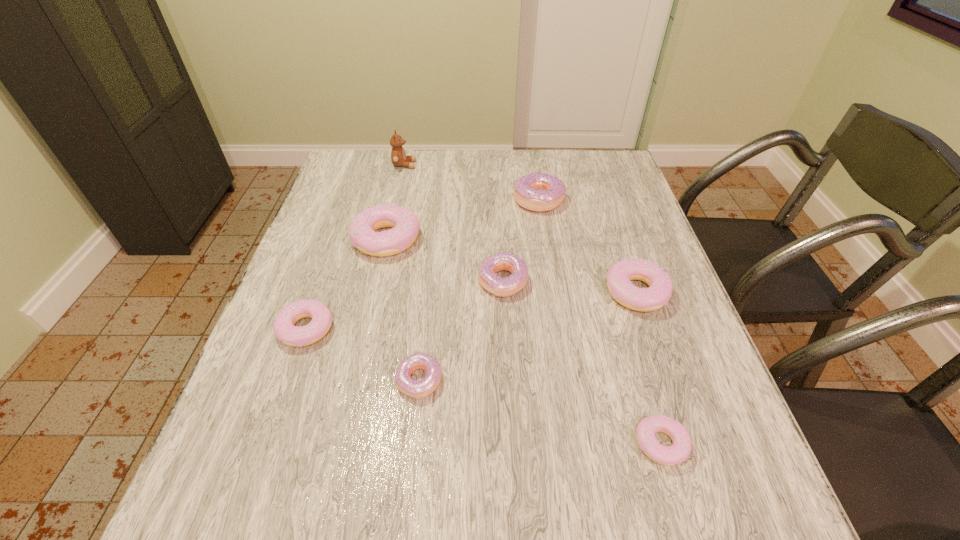
Where is `the nearest purple doughnut`? the nearest purple doughnut is located at coordinates (420, 389).

Image resolution: width=960 pixels, height=540 pixels. Find the location of `the shortest object`. the shortest object is located at coordinates (678, 452).

Find the location of a particular element. The width and height of the screenshot is (960, 540). the nearest pink doughnut is located at coordinates (678, 452).

The image size is (960, 540). I want to click on vacant point located 0.310m on the front-facing side of the brown teddy bear, so click(512, 165).

Where is `vacant space located on the right of the second farthest doughnut`? The height and width of the screenshot is (540, 960). vacant space located on the right of the second farthest doughnut is located at coordinates (504, 239).

Locate an element on the screen. free space located 0.340m on the left of the farthest purple doughnut is located at coordinates (396, 199).

Locate an element on the screen. Image resolution: width=960 pixels, height=540 pixels. vacant region located 0.190m on the left of the third smallest pink doughnut is located at coordinates (523, 292).

Find the location of a particular element. Image resolution: width=960 pixels, height=540 pixels. free space located on the front of the second biggest purple doughnut is located at coordinates (507, 372).

Where is `vacant space situated 0.080m on the right of the third biggest pink doughnut`? vacant space situated 0.080m on the right of the third biggest pink doughnut is located at coordinates (371, 329).

Locate an element on the screen. The height and width of the screenshot is (540, 960). vacant space located on the left of the smallest purple doughnut is located at coordinates (258, 380).